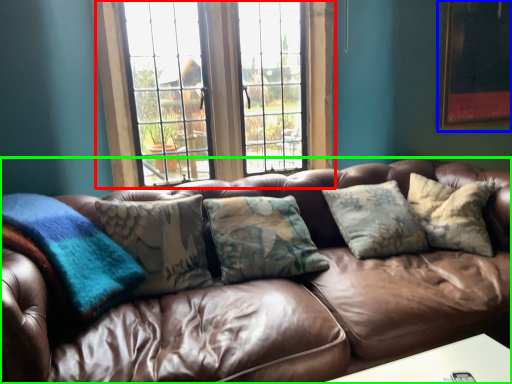
Question: Which object is the farthest from window (highlighted by a red box)? Choose among these: picture frame (highlighted by a blue box) or studio couch (highlighted by a green box).

Choices:
 (A) picture frame
 (B) studio couch

Answer: (A)